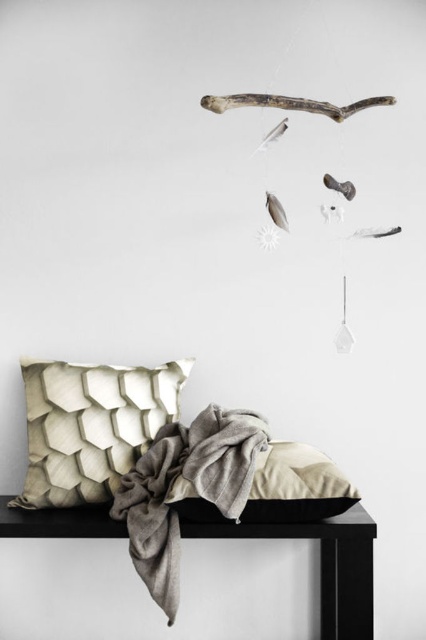
You are an interior designer assessing the space. You need to determine if the beige textured pillow at lower left can be placed on top of the black matte table at center without falling over. Can it be done?

The beige textured pillow at lower left is thinner than the black matte table at center, so it can be placed on top without stability issues as its smaller size would allow it to rest securely.

You are arranging a minimalist living room and need to place a 1.2 meter tall floor lamp next to the black matte table at center. Considering the beige textured pillow at lower left is already there, will the lamp fit in the space between the pillow and the wall?

The beige textured pillow at lower left is shorter than the black matte table at center. However, the height of the pillow does not directly affect the vertical space available for the floor lamp. Since the question is about fitting a 1.2 meter tall lamp, and no information about horizontal spacing or wall distance is provided, it cannot be determined from the given details.